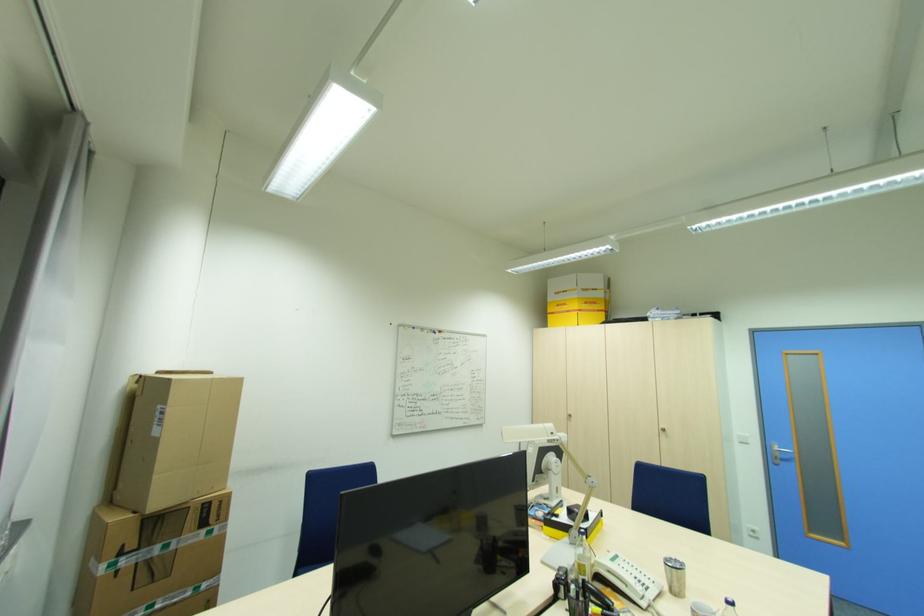
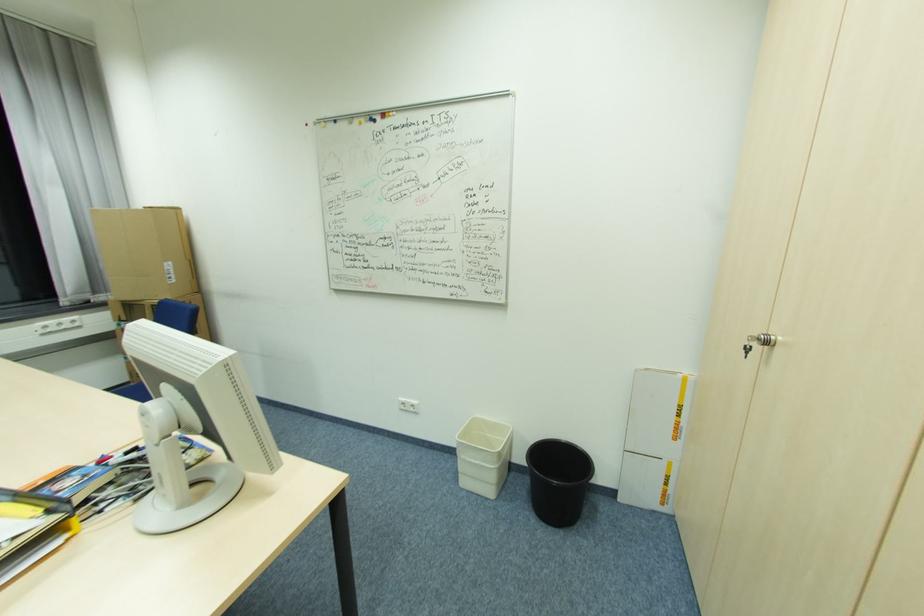
Locate, in the second image, the point that corresponds to the point at 573,416 in the first image.

(772, 344)